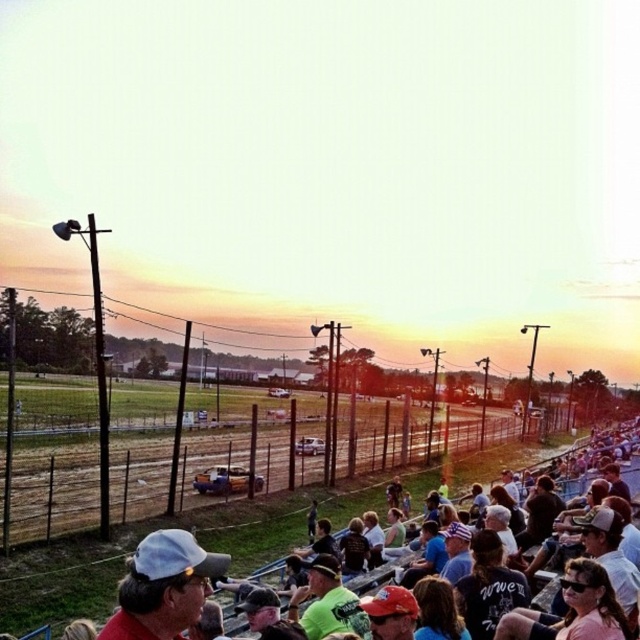
Which of these two, dark blue jersey at center or white cotton shirt at lower center, stands taller?

dark blue jersey at center

Is point (476, 624) farther from camera compared to point (372, 532)?

No, (476, 624) is in front of (372, 532).

You are a GUI agent. You are given a task and a screenshot of the screen. Output one action in this format:
    pyautogui.click(x=<x>, y=<y>)
    Task: Click on the dark blue jersey at center
    The width and height of the screenshot is (640, 640).
    Given the screenshot: What is the action you would take?
    pyautogui.click(x=488, y=586)

Consider the image. Does white matte baseball cap at lower left come behind green t-shirt at center?

No, white matte baseball cap at lower left is in front of green t-shirt at center.

Between point (140, 588) and point (394, 532), which one is positioned in front?

Point (140, 588) is more forward.

What do you see at coordinates (163, 586) in the screenshot?
I see `white matte baseball cap at lower left` at bounding box center [163, 586].

At what (x,y) coordinates should I click in order to perform the action: click on white matte baseball cap at lower left. Please return your answer as a coordinate pair (x, y). Image resolution: width=640 pixels, height=640 pixels. Looking at the image, I should click on (163, 586).

Is matte blue shirt at center taller than white cotton shirt at lower center?

Yes, matte blue shirt at center is taller than white cotton shirt at lower center.

Is matte blue shirt at center to the left of white cotton shirt at lower center from the viewer's perspective?

In fact, matte blue shirt at center is to the right of white cotton shirt at lower center.

Image resolution: width=640 pixels, height=640 pixels. Find the location of `matte blue shirt at center`. matte blue shirt at center is located at coordinates (426, 556).

Locate an element on the screen. This screenshot has height=640, width=640. matte blue shirt at center is located at coordinates (426, 556).